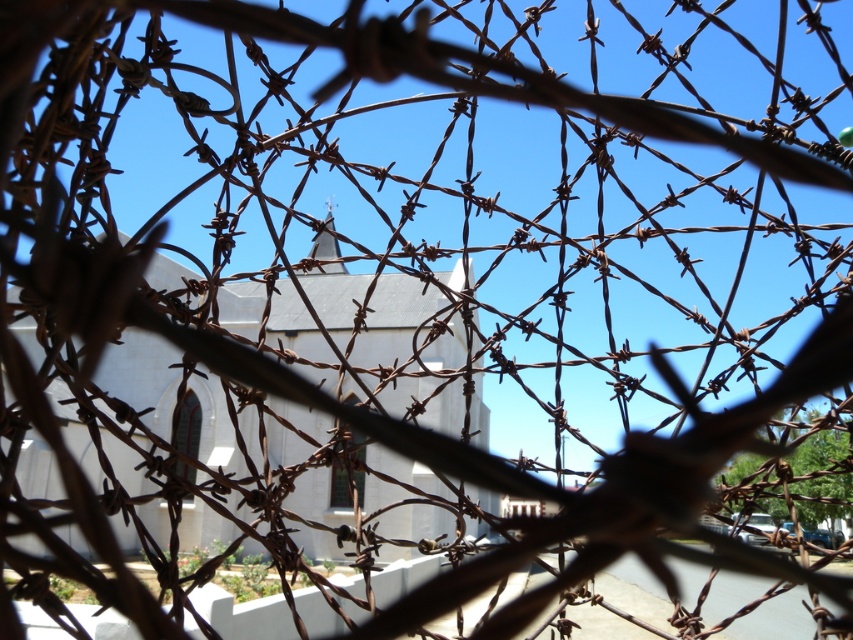
Between white matte chapel at center and rusty metal spire at center, which one appears on the left side from the viewer's perspective?

Positioned to the left is white matte chapel at center.

Between white matte chapel at center and rusty metal spire at center, which one appears on the right side from the viewer's perspective?

rusty metal spire at center

Measure the distance between point (167, 276) and camera.

28.45 meters

Where is `white matte chapel at center`? The height and width of the screenshot is (640, 853). white matte chapel at center is located at coordinates (142, 378).